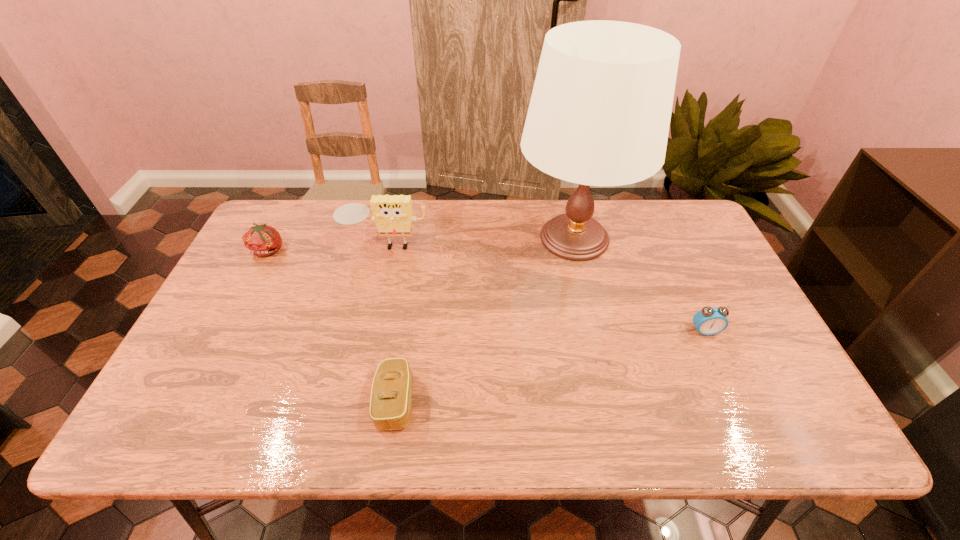
You are a GUI agent. You are given a task and a screenshot of the screen. Output one action in this format:
    pyautogui.click(x=<x>, y=<y>)
    Task: Click on the free point between the nearest object and the alarm clock
    The image size is (960, 540).
    Given the screenshot: What is the action you would take?
    pyautogui.click(x=550, y=366)

Find the location of `free space between the tomato and the fourth shortest object`. free space between the tomato and the fourth shortest object is located at coordinates (327, 247).

I want to click on empty location between the sponge and the nearest object, so click(x=391, y=323).

The height and width of the screenshot is (540, 960). I want to click on object that is the third closest to the sponge, so click(x=391, y=396).

This screenshot has height=540, width=960. What are the coordinates of `object that is the third closest to the tallest object` in the screenshot? It's located at (391, 396).

Find the location of `free region that satisfies the following two spatial constraints: 1. on the face of the alarm clock; 2. on the zipper side of the nearest object`. free region that satisfies the following two spatial constraints: 1. on the face of the alarm clock; 2. on the zipper side of the nearest object is located at coordinates (737, 402).

The image size is (960, 540). I want to click on free space that satisfies the following two spatial constraints: 1. on the face of the fourth farthest object; 2. on the zipper side of the nearest object, so click(x=737, y=402).